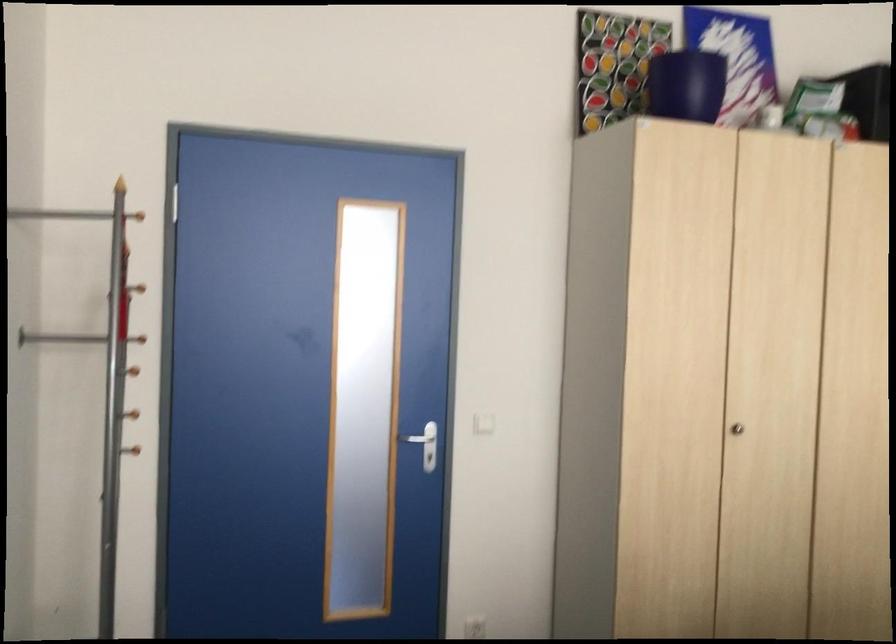
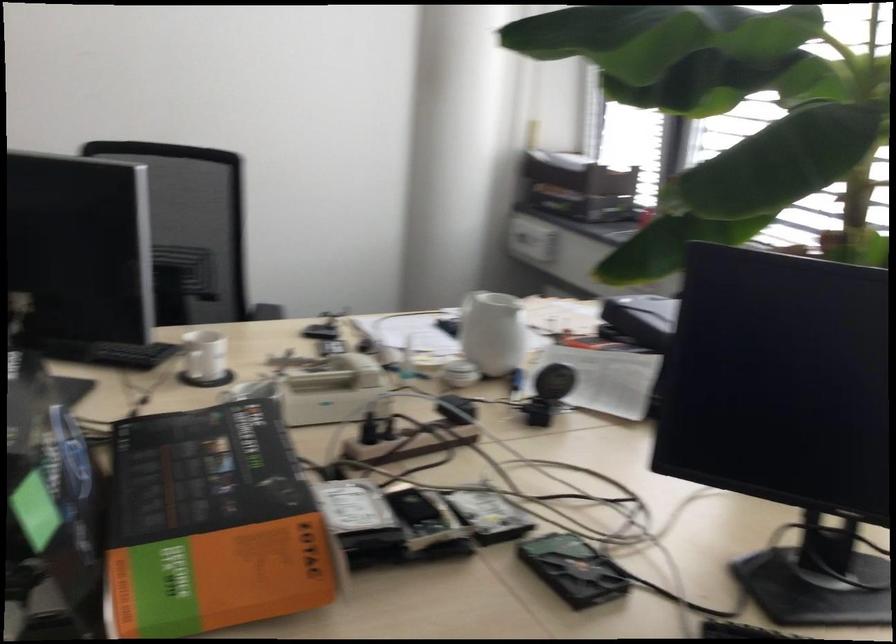
Based on the continuous images, in which direction is the camera rotating?

The camera rotated toward right-down.